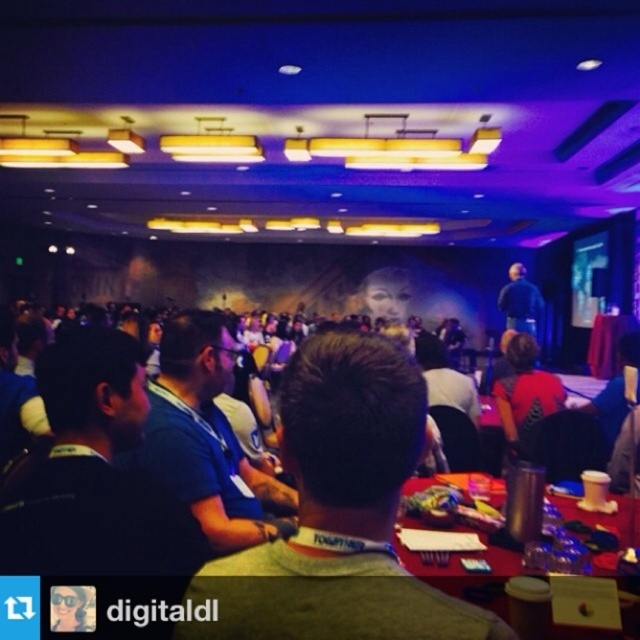
Does red plastic table at lower right have a lesser height compared to dark blue shirt at center?

Indeed, red plastic table at lower right has a lesser height compared to dark blue shirt at center.

Where is `red plastic table at lower right`? Image resolution: width=640 pixels, height=640 pixels. red plastic table at lower right is located at coordinates (468, 572).

Where is `red plastic table at lower right`? red plastic table at lower right is located at coordinates (468, 572).

Does white fabric lanyard at center appear under dark blue shirt at center?

Correct, white fabric lanyard at center is located below dark blue shirt at center.

Consider the image. Does white fabric lanyard at center have a lesser width compared to dark blue shirt at center?

Yes.

Identify the location of white fabric lanyard at center. (339, 513).

Locate an element on the screen. This screenshot has width=640, height=640. white fabric lanyard at center is located at coordinates (339, 513).

Is white fabric lanyard at center wider than red plastic table at lower right?

In fact, white fabric lanyard at center might be narrower than red plastic table at lower right.

Who is shorter, white fabric lanyard at center or red plastic table at lower right?

red plastic table at lower right is shorter.

What do you see at coordinates (339, 513) in the screenshot? Image resolution: width=640 pixels, height=640 pixels. I see `white fabric lanyard at center` at bounding box center [339, 513].

Locate an element on the screen. Image resolution: width=640 pixels, height=640 pixels. white fabric lanyard at center is located at coordinates (339, 513).